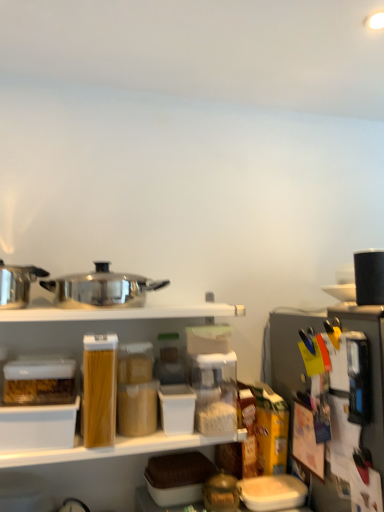
Question: Considering the relative sizes of black matte coffee maker at upper right, positioned as the fourth appliance in left-to-right order, and metallic silver coffee maker at right, the second appliance positioned from the right, in the image provided, is black matte coffee maker at upper right, positioned as the fourth appliance in left-to-right order, taller than metallic silver coffee maker at right, the second appliance positioned from the right,?

Choices:
 (A) yes
 (B) no

Answer: (B)

Question: From a real-world perspective, is black matte coffee maker at upper right, positioned as the fourth appliance in left-to-right order, physically below metallic silver coffee maker at right, the second appliance positioned from the right?

Choices:
 (A) no
 (B) yes

Answer: (A)

Question: From a real-world perspective, is black matte coffee maker at upper right, acting as the first appliance starting from the right, physically above metallic silver coffee maker at right, the second appliance positioned from the right?

Choices:
 (A) no
 (B) yes

Answer: (B)

Question: Can you confirm if black matte coffee maker at upper right, acting as the first appliance starting from the right, is positioned to the right of metallic silver coffee maker at right, which ranks as the 3th appliance in left-to-right order?

Choices:
 (A) yes
 (B) no

Answer: (A)

Question: Can you confirm if black matte coffee maker at upper right, acting as the first appliance starting from the right, is smaller than metallic silver coffee maker at right, which ranks as the 3th appliance in left-to-right order?

Choices:
 (A) yes
 (B) no

Answer: (A)

Question: Does point (153, 478) appear closer or farther from the camera than point (291, 318)?

Choices:
 (A) closer
 (B) farther

Answer: (A)

Question: Is brown woven basket at center taller or shorter than metallic silver coffee maker at right, which ranks as the 3th appliance in left-to-right order?

Choices:
 (A) short
 (B) tall

Answer: (A)

Question: Looking at the image, does brown woven basket at center seem bigger or smaller compared to metallic silver coffee maker at right, which ranks as the 3th appliance in left-to-right order?

Choices:
 (A) big
 (B) small

Answer: (B)

Question: Do you think brown woven basket at center is within metallic silver coffee maker at right, which ranks as the 3th appliance in left-to-right order, or outside of it?

Choices:
 (A) inside
 (B) outside

Answer: (B)

Question: Considering the positions of point (6, 284) and point (97, 266), is point (6, 284) closer or farther from the camera than point (97, 266)?

Choices:
 (A) farther
 (B) closer

Answer: (B)

Question: From the image's perspective, relative to polished stainless steel pot at center, positioned as the 2th appliance in left-to-right order, is polished stainless steel pot at left, which ranks as the first appliance in left-to-right order, above or below?

Choices:
 (A) below
 (B) above

Answer: (B)

Question: Looking at the image, does polished stainless steel pot at left, which ranks as the first appliance in left-to-right order, seem bigger or smaller compared to polished stainless steel pot at center, positioned as the 2th appliance in left-to-right order?

Choices:
 (A) small
 (B) big

Answer: (A)

Question: Considering the positions of polished stainless steel pot at left, which ranks as the first appliance in left-to-right order, and polished stainless steel pot at center, the third appliance in the right-to-left sequence, in the image, is polished stainless steel pot at left, which ranks as the first appliance in left-to-right order, wider or thinner than polished stainless steel pot at center, the third appliance in the right-to-left sequence,?

Choices:
 (A) thin
 (B) wide

Answer: (B)

Question: From the image's perspective, is polished stainless steel pot at center, positioned as the 2th appliance in left-to-right order, positioned above or below polished stainless steel pot at left, marked as the 4th appliance in a right-to-left arrangement?

Choices:
 (A) below
 (B) above

Answer: (A)

Question: Is polished stainless steel pot at center, the third appliance in the right-to-left sequence, taller or shorter than polished stainless steel pot at left, which ranks as the first appliance in left-to-right order?

Choices:
 (A) tall
 (B) short

Answer: (B)